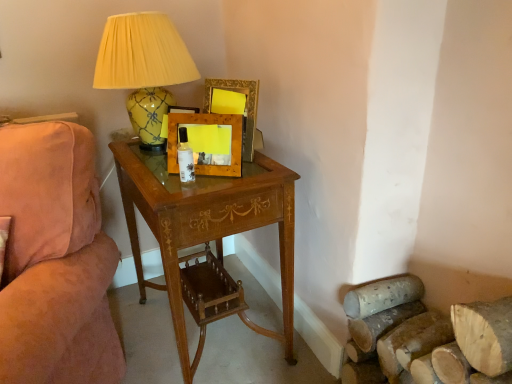
Measure the distance between wooden picture frame at center, marked as the 2th picture frame in a back-to-front arrangement, and camera.

1.20 meters.

The width and height of the screenshot is (512, 384). I want to click on wooden picture frame at upper center, which appears as the 1th picture frame when viewed from the back, so click(236, 107).

The image size is (512, 384). What do you see at coordinates (144, 68) in the screenshot?
I see `yellow glossy ceramic lamp at upper left` at bounding box center [144, 68].

Image resolution: width=512 pixels, height=384 pixels. Describe the element at coordinates (55, 260) in the screenshot. I see `suede pink couch at left` at that location.

What do you see at coordinates (206, 234) in the screenshot? I see `wooden desk at center` at bounding box center [206, 234].

Where is `wooden picture frame at center, marked as the 2th picture frame in a back-to-front arrangement`? wooden picture frame at center, marked as the 2th picture frame in a back-to-front arrangement is located at coordinates (207, 123).

From a real-world perspective, is wooden picture frame at center, marked as the 2th picture frame in a back-to-front arrangement, below suede pink couch at left?

No, from a real-world perspective, wooden picture frame at center, marked as the 2th picture frame in a back-to-front arrangement, is not below suede pink couch at left.

Considering the relative positions of wooden picture frame at center, marked as the first picture frame in a front-to-back arrangement, and suede pink couch at left in the image provided, is wooden picture frame at center, marked as the first picture frame in a front-to-back arrangement, in front of suede pink couch at left?

No, it is behind suede pink couch at left.

Consider the image. Is wooden picture frame at center, marked as the first picture frame in a front-to-back arrangement, not inside suede pink couch at left?

Yes, wooden picture frame at center, marked as the first picture frame in a front-to-back arrangement, is not within suede pink couch at left.

Is wooden picture frame at center, marked as the first picture frame in a front-to-back arrangement, facing towards suede pink couch at left?

No, wooden picture frame at center, marked as the first picture frame in a front-to-back arrangement, is not facing towards suede pink couch at left.

Could you tell me if wooden picture frame at upper center, placed as the second picture frame when sorted from front to back, is facing suede pink couch at left?

Yes, wooden picture frame at upper center, placed as the second picture frame when sorted from front to back, is aimed at suede pink couch at left.

Is wooden picture frame at upper center, which appears as the 1th picture frame when viewed from the back, positioned far away from suede pink couch at left?

No, there isn't a large distance between wooden picture frame at upper center, which appears as the 1th picture frame when viewed from the back, and suede pink couch at left.

Considering the relative sizes of wooden picture frame at upper center, which appears as the 1th picture frame when viewed from the back, and suede pink couch at left in the image provided, is wooden picture frame at upper center, which appears as the 1th picture frame when viewed from the back, wider than suede pink couch at left?

No, wooden picture frame at upper center, which appears as the 1th picture frame when viewed from the back, is not wider than suede pink couch at left.

Is wooden picture frame at upper center, placed as the second picture frame when sorted from front to back, spatially inside suede pink couch at left, or outside of it?

wooden picture frame at upper center, placed as the second picture frame when sorted from front to back, is not inside suede pink couch at left, it's outside.

Find the location of a particular element. This screenshot has height=384, width=512. lamp located behind the suede pink couch at left is located at coordinates (144, 68).

Which object is thinner, yellow glossy ceramic lamp at upper left or suede pink couch at left?

Thinner between the two is yellow glossy ceramic lamp at upper left.

Is yellow glossy ceramic lamp at upper left situated inside suede pink couch at left or outside?

The correct answer is: outside.

Would you say yellow glossy ceramic lamp at upper left is a long distance from suede pink couch at left?

That's not correct — yellow glossy ceramic lamp at upper left is a little close to suede pink couch at left.

Which object is further away from the camera, wooden picture frame at upper center, placed as the second picture frame when sorted from front to back, or wooden picture frame at center, marked as the 2th picture frame in a back-to-front arrangement?

wooden picture frame at upper center, placed as the second picture frame when sorted from front to back, is further from the camera.

From the image's perspective, is wooden picture frame at upper center, placed as the second picture frame when sorted from front to back, positioned above or below wooden picture frame at center, marked as the first picture frame in a front-to-back arrangement?

wooden picture frame at upper center, placed as the second picture frame when sorted from front to back, is above wooden picture frame at center, marked as the first picture frame in a front-to-back arrangement.

Based on the photo, how different are the orientations of wooden picture frame at upper center, which appears as the 1th picture frame when viewed from the back, and wooden picture frame at center, marked as the 2th picture frame in a back-to-front arrangement, in degrees?

There is a 16.2-degree angle between the facing directions of wooden picture frame at upper center, which appears as the 1th picture frame when viewed from the back, and wooden picture frame at center, marked as the 2th picture frame in a back-to-front arrangement.

From the picture: Can you confirm if wooden desk at center is wider than wooden picture frame at center, marked as the 2th picture frame in a back-to-front arrangement?

Yes.

Is point (240, 222) behind point (233, 169)?

No, (240, 222) is in front of (233, 169).

Can you confirm if wooden desk at center is bigger than wooden picture frame at center, marked as the first picture frame in a front-to-back arrangement?

Correct, wooden desk at center is larger in size than wooden picture frame at center, marked as the first picture frame in a front-to-back arrangement.

Is wooden desk at center positioned before wooden picture frame at center, marked as the first picture frame in a front-to-back arrangement?

Yes, it is.

From the image's perspective, relative to wooden picture frame at upper center, which appears as the 1th picture frame when viewed from the back, is suede pink couch at left above or below?

suede pink couch at left is below wooden picture frame at upper center, which appears as the 1th picture frame when viewed from the back.

Is suede pink couch at left not within wooden picture frame at upper center, placed as the second picture frame when sorted from front to back?

That's correct, suede pink couch at left is outside of wooden picture frame at upper center, placed as the second picture frame when sorted from front to back.

Is suede pink couch at left facing towards wooden picture frame at upper center, which appears as the 1th picture frame when viewed from the back?

No.

Between suede pink couch at left and wooden picture frame at upper center, which appears as the 1th picture frame when viewed from the back, which one has more height?

suede pink couch at left is taller.

Is yellow glossy ceramic lamp at upper left facing towards wooden picture frame at center, marked as the 2th picture frame in a back-to-front arrangement?

No, yellow glossy ceramic lamp at upper left is not aimed at wooden picture frame at center, marked as the 2th picture frame in a back-to-front arrangement.

Is yellow glossy ceramic lamp at upper left far away from wooden picture frame at center, marked as the first picture frame in a front-to-back arrangement?

No, there isn't a large distance between yellow glossy ceramic lamp at upper left and wooden picture frame at center, marked as the first picture frame in a front-to-back arrangement.

From a real-world perspective, is yellow glossy ceramic lamp at upper left located higher than wooden picture frame at center, marked as the 2th picture frame in a back-to-front arrangement?

Yes, from a real-world perspective, yellow glossy ceramic lamp at upper left is over wooden picture frame at center, marked as the 2th picture frame in a back-to-front arrangement

Find the location of a particular element. The image size is (512, 384). the 1st picture frame positioned above the suede pink couch at left (from a real-world perspective) is located at coordinates (207, 123).

Which picture frame is the 2nd one when counting from the right side of the suede pink couch at left? Please provide its 2D coordinates.

[(236, 107)]

From the image, which object appears to be farther from wooden picture frame at center, marked as the 2th picture frame in a back-to-front arrangement, suede pink couch at left or wooden picture frame at upper center, which appears as the 1th picture frame when viewed from the back?

suede pink couch at left lies further to wooden picture frame at center, marked as the 2th picture frame in a back-to-front arrangement, than the other object.

Based on their spatial positions, is wooden picture frame at upper center, which appears as the 1th picture frame when viewed from the back, or suede pink couch at left closer to wooden desk at center?

suede pink couch at left is positioned closer to the anchor wooden desk at center.

Considering their positions, is yellow glossy ceramic lamp at upper left positioned further to wooden picture frame at upper center, placed as the second picture frame when sorted from front to back, than wooden desk at center?

wooden desk at center.

Which object lies nearer to the anchor point suede pink couch at left, yellow glossy ceramic lamp at upper left or wooden desk at center?

The object closer to suede pink couch at left is wooden desk at center.

Estimate the real-world distances between objects in this image. Which object is closer to yellow glossy ceramic lamp at upper left, wooden desk at center or suede pink couch at left?

wooden desk at center.

From the image, which object appears to be farther from wooden desk at center, wooden picture frame at center, marked as the 2th picture frame in a back-to-front arrangement, or yellow glossy ceramic lamp at upper left?

Based on the image, yellow glossy ceramic lamp at upper left appears to be further to wooden desk at center.

When comparing their distances from wooden picture frame at upper center, placed as the second picture frame when sorted from front to back, does wooden picture frame at center, marked as the first picture frame in a front-to-back arrangement, or suede pink couch at left seem closer?

wooden picture frame at center, marked as the first picture frame in a front-to-back arrangement, lies closer to wooden picture frame at upper center, placed as the second picture frame when sorted from front to back, than the other object.

Looking at the image, which one is located closer to wooden picture frame at upper center, which appears as the 1th picture frame when viewed from the back, suede pink couch at left or wooden desk at center?

wooden desk at center.

What are the coordinates of `desk between suede pink couch at left and wooden picture frame at upper center, placed as the second picture frame when sorted from front to back, in the horizontal direction` in the screenshot? It's located at (206, 234).

You are a GUI agent. You are given a task and a screenshot of the screen. Output one action in this format:
    pyautogui.click(x=<x>, y=<y>)
    Task: Click on the picture frame that lies between wooden picture frame at upper center, placed as the second picture frame when sorted from front to back, and wooden desk at center from top to bottom
    This screenshot has width=512, height=384.
    Given the screenshot: What is the action you would take?
    pyautogui.click(x=207, y=123)

At what (x,y) coordinates should I click in order to perform the action: click on desk located between suede pink couch at left and wooden picture frame at center, marked as the 2th picture frame in a back-to-front arrangement, in the left-right direction. Please return your answer as a coordinate pair (x, y). Looking at the image, I should click on (206, 234).

Where is `desk that lies between yellow glossy ceramic lamp at upper left and suede pink couch at left from top to bottom`? Image resolution: width=512 pixels, height=384 pixels. desk that lies between yellow glossy ceramic lamp at upper left and suede pink couch at left from top to bottom is located at coordinates (206, 234).